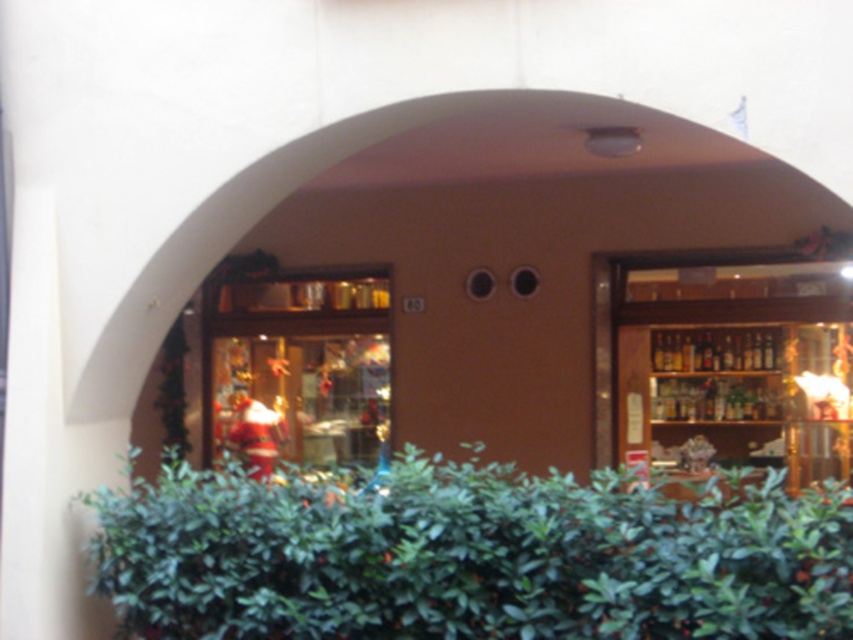
You are a delivery person carrying a box that is 2 meters long. You need to navigate through the entrance shown in the image. Can you fit the box horizontally between the green leafy hedge at lower center and the wooden shelves at center?

The distance between the green leafy hedge at lower center and the wooden shelves at center is 7.69 meters. Since the box is only 2 meters long, it can easily fit horizontally between them.

You are a delivery person trying to see Santa Claus through the window. There is a green leafy hedge at lower center in the way. Can you see Santa Claus figure at center over the hedge?

The green leafy hedge at lower center is not as tall as the Santa Claus figure at center, so yes, you can see Santa Claus figure at center over the hedge.

You are a customer entering the building through the archway and see the green leafy hedge at lower center and the santa claus figure at center. Which object is closer to your right side as you face the entrance?

The green leafy hedge at lower center is positioned on the right side of the santa claus figure at center, so when facing the entrance, the green leafy hedge at lower center would be closer to your right side.